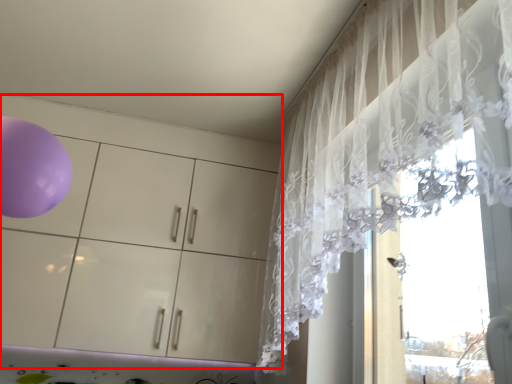
Question: From the image's perspective, considering the relative positions of dresser (annotated by the red box) and curtain in the image provided, where is dresser (annotated by the red box) located with respect to the staircase?

Choices:
 (A) above
 (B) below

Answer: (B)